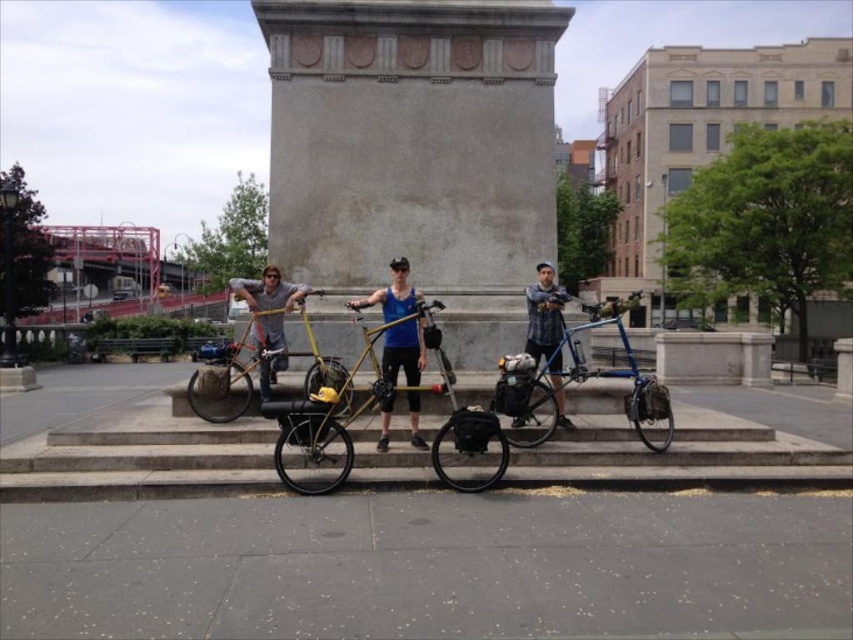
You are standing on the stone steps in front of the monument and want to move your blue metallic bicycle at center to the yellow matte bicycle at center. Given that the distance between them is 27.01 feet, can you push it directly without needing to lift it over the steps?

The blue metallic bicycle at center is 27.01 feet away from the yellow matte bicycle at center. Since the distance is over 27 feet, you can push it directly without needing to lift it over the steps as there is enough space.

You are planning to park your bicycle in a narrow alley that can only accommodate bicycles with a maximum width of 50 cm. You observe the blue metallic bicycle at center and the yellow matte bicycle at center in the scene. Which bicycle would you choose to park in the alley to ensure it fits?

The yellow matte bicycle at center has a smaller width compared to the blue metallic bicycle at center, so it would fit better in the narrow alley with a maximum width of 50 cm.

You are a photographer trying to capture the smooth concrete monument at center and the blue tank top at center in a single shot. Based on their sizes, which object will appear larger in the photo?

The smooth concrete monument at center will appear larger in the photo because it has a greater height compared to the blue tank top at center.